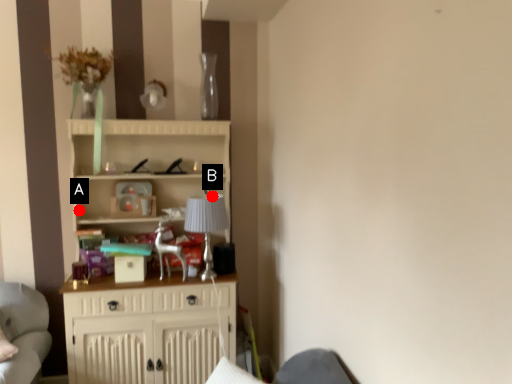
Question: Two points are circled on the image, labeled by A and B beside each circle. Which point appears farthest from the camera in this image?

Choices:
 (A) A is further
 (B) B is further

Answer: (A)